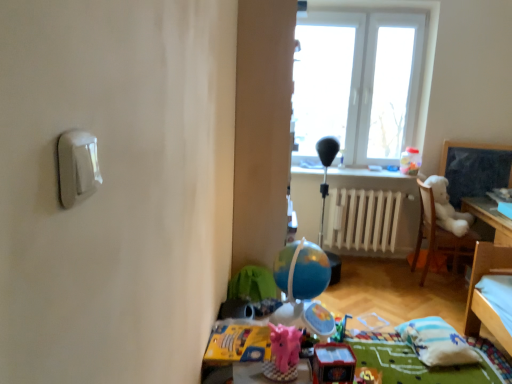
Question: From a real-world perspective, is white plastic light switch at upper left under white plush bear at right?

Choices:
 (A) yes
 (B) no

Answer: (B)

Question: Is white plastic light switch at upper left outside of white plush bear at right?

Choices:
 (A) yes
 (B) no

Answer: (A)

Question: Does white plastic light switch at upper left have a smaller size compared to white plush bear at right?

Choices:
 (A) no
 (B) yes

Answer: (B)

Question: Considering the relative sizes of white plastic light switch at upper left and white plush bear at right in the image provided, is white plastic light switch at upper left bigger than white plush bear at right?

Choices:
 (A) yes
 (B) no

Answer: (B)

Question: Does white plastic light switch at upper left appear on the right side of white plush bear at right?

Choices:
 (A) no
 (B) yes

Answer: (A)

Question: Is white plastic light switch at upper left at the left side of white plush bear at right?

Choices:
 (A) no
 (B) yes

Answer: (B)

Question: Does white soft pillow at lower right have a lesser width compared to pink fabric stuffed animal at center, the second toy positioned from the back?

Choices:
 (A) yes
 (B) no

Answer: (B)

Question: Is white soft pillow at lower right facing towards pink fabric stuffed animal at center, the second toy positioned from the back?

Choices:
 (A) no
 (B) yes

Answer: (A)

Question: From the image's perspective, would you say white soft pillow at lower right is shown under pink fabric stuffed animal at center, placed as the 1th toy when sorted from left to right?

Choices:
 (A) no
 (B) yes

Answer: (B)

Question: Is white soft pillow at lower right positioned far away from pink fabric stuffed animal at center, the second toy positioned from the back?

Choices:
 (A) no
 (B) yes

Answer: (B)

Question: Is pink fabric stuffed animal at center, marked as the 2th toy in a front-to-back arrangement, surrounded by white soft pillow at lower right?

Choices:
 (A) no
 (B) yes

Answer: (A)

Question: Is white soft pillow at lower right located outside pink fabric stuffed animal at center, the second toy positioned from the back?

Choices:
 (A) no
 (B) yes

Answer: (B)

Question: Is white painted metal radiator at center taller than translucent plastic container at upper right, placed as the 1th toy when sorted from top to bottom?

Choices:
 (A) yes
 (B) no

Answer: (A)